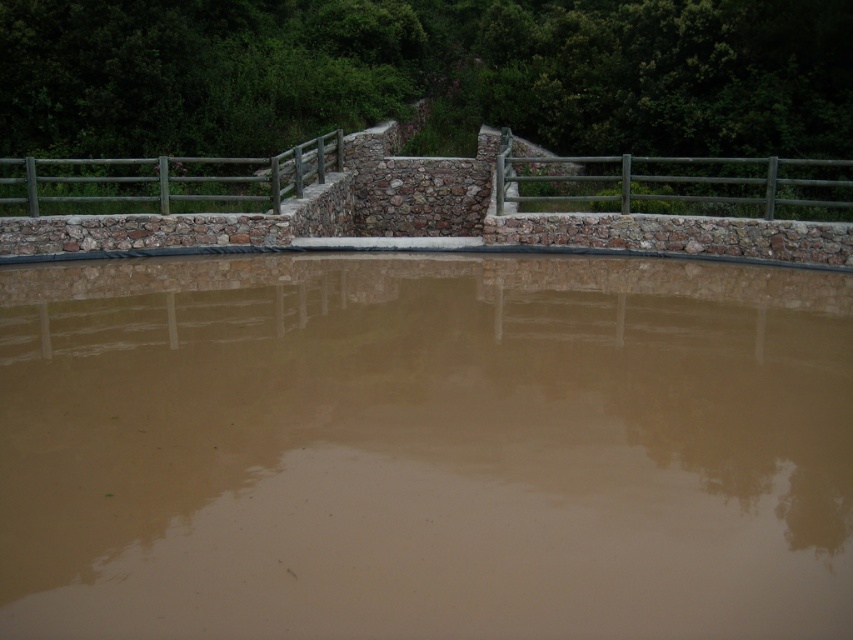
Can you confirm if brown matte water at center is shorter than green metallic rail at upper right?

In fact, brown matte water at center may be taller than green metallic rail at upper right.

Can you confirm if brown matte water at center is positioned to the left of green metallic rail at upper right?

Yes, brown matte water at center is to the left of green metallic rail at upper right.

Does point (360, 428) come closer to viewer compared to point (813, 198)?

Yes, it is in front of point (813, 198).

At what (x,y) coordinates should I click in order to perform the action: click on brown matte water at center. Please return your answer as a coordinate pair (x, y). Image resolution: width=853 pixels, height=640 pixels. Looking at the image, I should click on pyautogui.click(x=424, y=448).

Does brown matte water at center have a greater width compared to green wooden rail at upper center?

Yes, brown matte water at center is wider than green wooden rail at upper center.

From the picture: Can you confirm if brown matte water at center is taller than green wooden rail at upper center?

Incorrect, brown matte water at center's height is not larger of green wooden rail at upper center's.

Which is in front, point (519, 524) or point (260, 163)?

Point (519, 524) is more forward.

The height and width of the screenshot is (640, 853). Identify the location of brown matte water at center. (424, 448).

Between point (519, 161) and point (167, 186), which one is positioned behind?

Point (519, 161)

Which is more to the left, green metallic rail at upper right or green wooden rail at upper center?

green wooden rail at upper center is more to the left.

Does point (621, 163) lie behind point (49, 170)?

No, (621, 163) is in front of (49, 170).

Where is `green metallic rail at upper right`? Image resolution: width=853 pixels, height=640 pixels. green metallic rail at upper right is located at coordinates (677, 186).